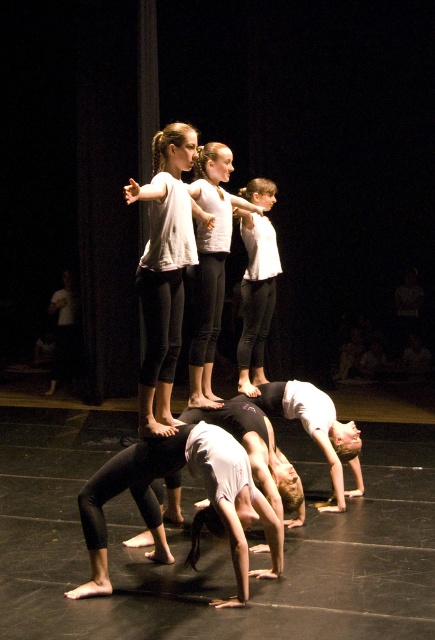
Consider the image. Can you confirm if white matte t-shirt at center is positioned to the right of white matte shirt at center?

No, white matte t-shirt at center is not to the right of white matte shirt at center.

Is white matte t-shirt at center taller than white matte shirt at center?

Indeed, white matte t-shirt at center has a greater height compared to white matte shirt at center.

The width and height of the screenshot is (435, 640). What do you see at coordinates (210, 262) in the screenshot? I see `white matte t-shirt at center` at bounding box center [210, 262].

Locate an element on the screen. white matte t-shirt at center is located at coordinates (210, 262).

Can you confirm if matte white shirt at center is positioned to the left of white matte t-shirt at center?

Indeed, matte white shirt at center is positioned on the left side of white matte t-shirt at center.

Is point (161, 426) positioned before point (220, 179)?

Yes, it is.

The height and width of the screenshot is (640, 435). What do you see at coordinates (164, 269) in the screenshot? I see `matte white shirt at center` at bounding box center [164, 269].

Where is `matte white shirt at center`? matte white shirt at center is located at coordinates (164, 269).

Is matte white shirt at center to the left of white matte shirt at center from the viewer's perspective?

Correct, you'll find matte white shirt at center to the left of white matte shirt at center.

Who is higher up, matte white shirt at center or white matte shirt at center?

white matte shirt at center is higher up.

Does point (124, 193) lie behind point (247, 276)?

Yes, point (124, 193) is farther from viewer.

Find the location of a particular element. The image size is (435, 640). matte white shirt at center is located at coordinates (164, 269).